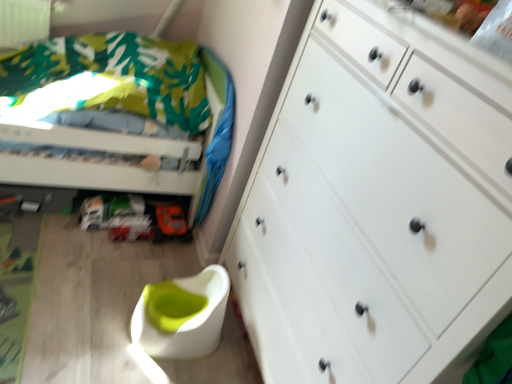
The height and width of the screenshot is (384, 512). Describe the element at coordinates (112, 212) in the screenshot. I see `orange matte toy car at lower center` at that location.

Identify the location of white plastic swivel chair at lower center. The width and height of the screenshot is (512, 384). (182, 315).

You are a GUI agent. You are given a task and a screenshot of the screen. Output one action in this format:
    pyautogui.click(x=<x>, y=<y>)
    Task: Click on the toy car on the left of the white plastic swivel chair at lower center
    The height and width of the screenshot is (384, 512).
    Given the screenshot: What is the action you would take?
    pyautogui.click(x=112, y=212)

From the image's perspective, is white plastic swivel chair at lower center located beneath orange matte toy car at lower center?

Correct, white plastic swivel chair at lower center appears lower than orange matte toy car at lower center in the image.

From the image's perspective, relative to green fabric bed at upper left, is white plastic swivel chair at lower center above or below?

Based on their image positions, white plastic swivel chair at lower center is located beneath green fabric bed at upper left.

Considering the sizes of white plastic swivel chair at lower center and green fabric bed at upper left in the image, is white plastic swivel chair at lower center wider or thinner than green fabric bed at upper left?

white plastic swivel chair at lower center is thinner than green fabric bed at upper left.

Is point (175, 298) less distant than point (214, 183)?

Yes, it is.

Considering the sizes of objects white matte chest of drawers at right and white plastic swivel chair at lower center in the image provided, who is bigger, white matte chest of drawers at right or white plastic swivel chair at lower center?

white matte chest of drawers at right is bigger.

Based on the photo, is white matte chest of drawers at right at the left side of white plastic swivel chair at lower center?

No.

Does white matte chest of drawers at right have a lesser height compared to white plastic swivel chair at lower center?

No, white matte chest of drawers at right is not shorter than white plastic swivel chair at lower center.

Is white matte chest of drawers at right facing towards white plastic swivel chair at lower center?

Yes, white matte chest of drawers at right is oriented towards white plastic swivel chair at lower center.

Considering the relative sizes of white matte chest of drawers at right and green fabric bed at upper left in the image provided, is white matte chest of drawers at right bigger than green fabric bed at upper left?

Yes, white matte chest of drawers at right is bigger than green fabric bed at upper left.

Between point (302, 329) and point (128, 100), which one is positioned behind?

Positioned behind is point (128, 100).

Is white matte chest of drawers at right looking in the opposite direction of green fabric bed at upper left?

No, white matte chest of drawers at right is not facing the opposite direction of green fabric bed at upper left.

Find the location of a particular element. The width and height of the screenshot is (512, 384). bed below the white matte chest of drawers at right (from a real-world perspective) is located at coordinates (127, 85).

How different are the orientations of green fabric bed at upper left and white matte chest of drawers at right in degrees?

The angular difference between green fabric bed at upper left and white matte chest of drawers at right is 1.24 degrees.

Would you say green fabric bed at upper left is to the left or to the right of white matte chest of drawers at right in the picture?

green fabric bed at upper left is positioned on white matte chest of drawers at right's left side.

Does point (133, 57) come behind point (256, 242)?

Yes, it is.

Does green fabric bed at upper left have a greater height compared to white matte chest of drawers at right?

Incorrect, the height of green fabric bed at upper left is not larger of that of white matte chest of drawers at right.

Which is in front, point (51, 43) or point (141, 207)?

The point (141, 207) is in front.

Considering the sizes of green fabric bed at upper left and orange matte toy car at lower center in the image, is green fabric bed at upper left bigger or smaller than orange matte toy car at lower center?

In the image, green fabric bed at upper left appears to be larger than orange matte toy car at lower center.

In the scene shown: Is green fabric bed at upper left inside or outside of orange matte toy car at lower center?

green fabric bed at upper left is not inside orange matte toy car at lower center, it's outside.

Based on the photo, could you tell me if green fabric bed at upper left is turned towards orange matte toy car at lower center?

No, green fabric bed at upper left does not turn towards orange matte toy car at lower center.

Could you tell me if orange matte toy car at lower center is facing green fabric bed at upper left?

Yes, orange matte toy car at lower center is turned towards green fabric bed at upper left.

From a real-world perspective, does orange matte toy car at lower center stand above green fabric bed at upper left?

Actually, orange matte toy car at lower center is physically below green fabric bed at upper left in the real world.

Is orange matte toy car at lower center not close to green fabric bed at upper left?

No, orange matte toy car at lower center is not far from green fabric bed at upper left.

Which is more to the left, orange matte toy car at lower center or green fabric bed at upper left?

From the viewer's perspective, green fabric bed at upper left appears more on the left side.

This screenshot has width=512, height=384. Find the location of `toy car above the white plastic swivel chair at lower center (from the image's perspective)`. toy car above the white plastic swivel chair at lower center (from the image's perspective) is located at coordinates 112,212.

Locate an element on the screen. This screenshot has height=384, width=512. swivel chair on the right of green fabric bed at upper left is located at coordinates (182, 315).

Looking at the image, which one is located further to white plastic swivel chair at lower center, white matte chest of drawers at right or green fabric bed at upper left?

Based on the image, green fabric bed at upper left appears to be further to white plastic swivel chair at lower center.

Looking at the image, which one is located closer to green fabric bed at upper left, white plastic swivel chair at lower center or orange matte toy car at lower center?

orange matte toy car at lower center is closer to green fabric bed at upper left.

Estimate the real-world distances between objects in this image. Which object is closer to orange matte toy car at lower center, green fabric bed at upper left or white matte chest of drawers at right?

green fabric bed at upper left.

Estimate the real-world distances between objects in this image. Which object is further from green fabric bed at upper left, orange matte toy car at lower center or white plastic swivel chair at lower center?

white plastic swivel chair at lower center lies further to green fabric bed at upper left than the other object.

Looking at this image, considering their positions, is white matte chest of drawers at right positioned closer to orange matte toy car at lower center than white plastic swivel chair at lower center?

Among the two, white plastic swivel chair at lower center is located nearer to orange matte toy car at lower center.

Looking at the image, which one is located closer to green fabric bed at upper left, white matte chest of drawers at right or white plastic swivel chair at lower center?

Among the two, white plastic swivel chair at lower center is located nearer to green fabric bed at upper left.

Looking at the image, which one is located further to white matte chest of drawers at right, green fabric bed at upper left or orange matte toy car at lower center?

Based on the image, orange matte toy car at lower center appears to be further to white matte chest of drawers at right.

Which object lies further to the anchor point white plastic swivel chair at lower center, orange matte toy car at lower center or white matte chest of drawers at right?

Among the two, white matte chest of drawers at right is located further to white plastic swivel chair at lower center.

Where is `toy car between green fabric bed at upper left and white plastic swivel chair at lower center from top to bottom`? This screenshot has width=512, height=384. toy car between green fabric bed at upper left and white plastic swivel chair at lower center from top to bottom is located at coordinates (112, 212).

Locate an element on the screen. Image resolution: width=512 pixels, height=384 pixels. bed between white matte chest of drawers at right and orange matte toy car at lower center in the front-back direction is located at coordinates click(127, 85).

This screenshot has height=384, width=512. I want to click on swivel chair located between green fabric bed at upper left and white matte chest of drawers at right in the left-right direction, so click(182, 315).

Find the location of `swivel chair positioned between white matte chest of drawers at right and orange matte toy car at lower center from near to far`. swivel chair positioned between white matte chest of drawers at right and orange matte toy car at lower center from near to far is located at coordinates coord(182,315).